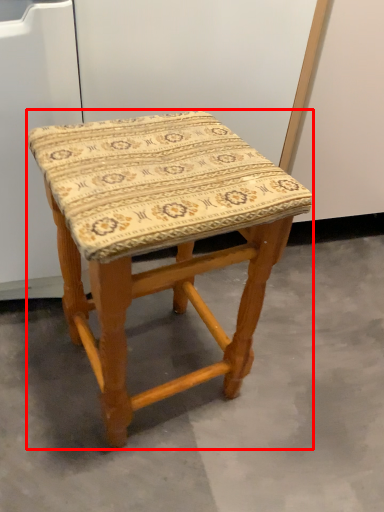
Question: Observing the image, what is the correct spatial positioning of stool (annotated by the red box) in reference to concrete?

Choices:
 (A) right
 (B) left

Answer: (B)